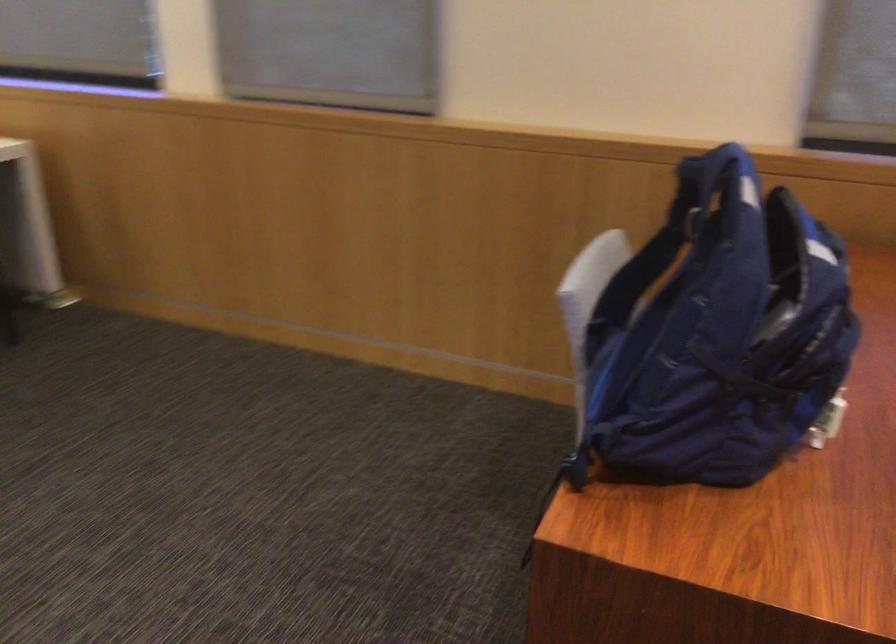
Identify the location of backpack strap buckle. Image resolution: width=896 pixels, height=644 pixels. (687, 216).